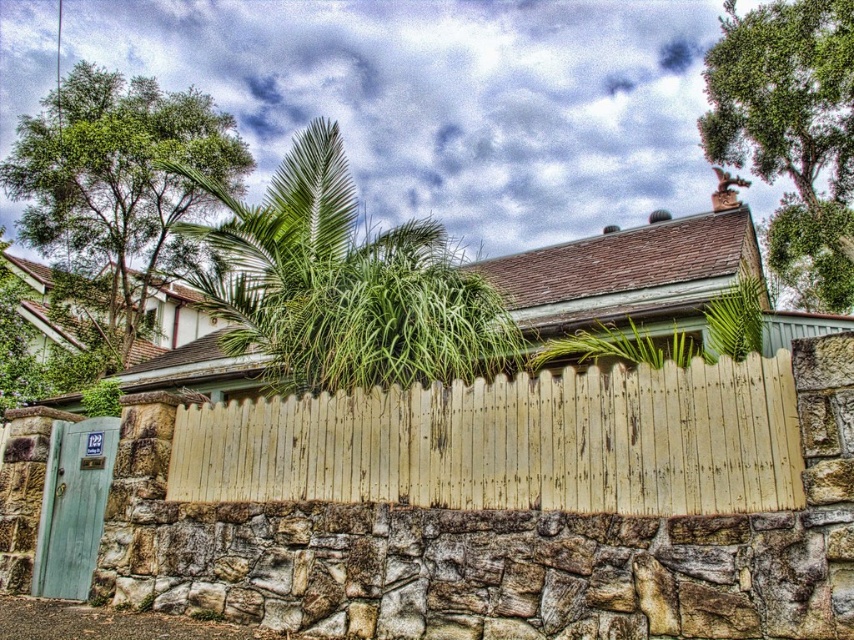
You are standing at the origin point of the coordinate system. You need to walk towards the yellow weathered wood fence at center. What direction should you head in?

The yellow weathered wood fence at center is located at point [513,444], so you should head northeast to reach it.

You are standing in a garden and want to take a closer look at the yellow weathered wood fence at center. If you walk forward 3 meters, will you be able to touch the fence?

The yellow weathered wood fence at center is 4.30 meters away from you. After walking 3 meters forward, you will still be 1.30 meters away from the fence, so you cannot touch it yet.

You are a painter standing at the base of the yellow weathered wood fence at center and want to paint the green leafy tree at upper right. Since you can only reach up to 2 meters, can you paint the tree without a ladder?

The yellow weathered wood fence at center is not as tall as the green leafy tree at upper right, so the tree is taller than 2 meters. Therefore, you will need a ladder to reach it.